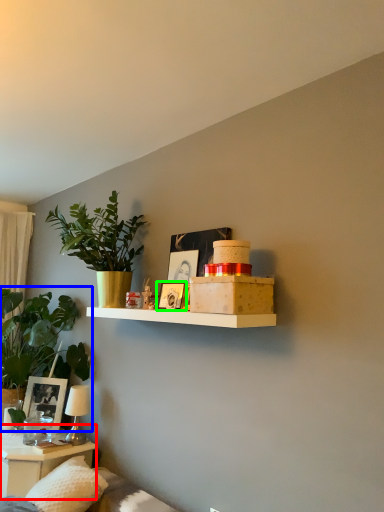
Question: Which object is positioned farthest from table (highlighted by a red box)? Select from houseplant (highlighted by a blue box) and picture frame (highlighted by a green box).

Choices:
 (A) houseplant
 (B) picture frame

Answer: (B)